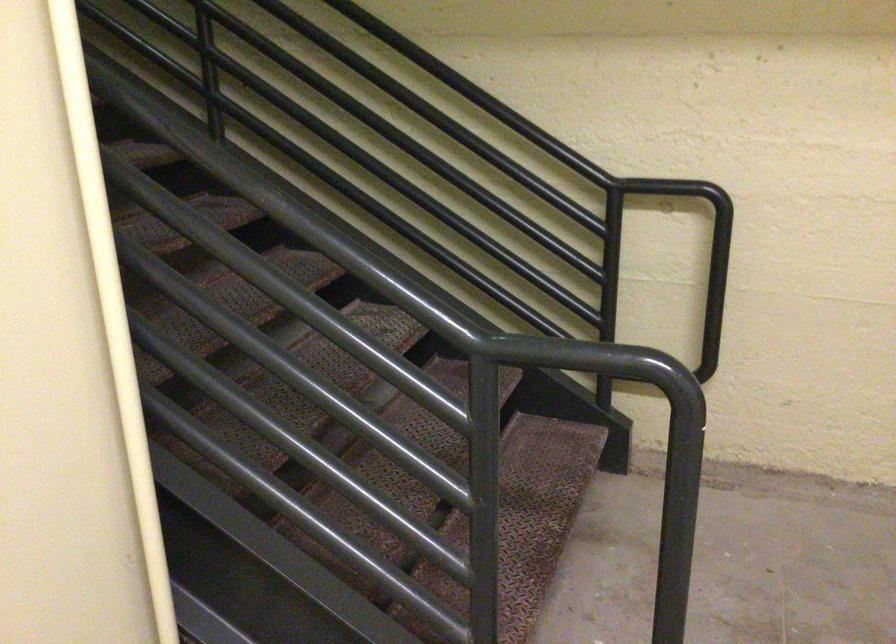
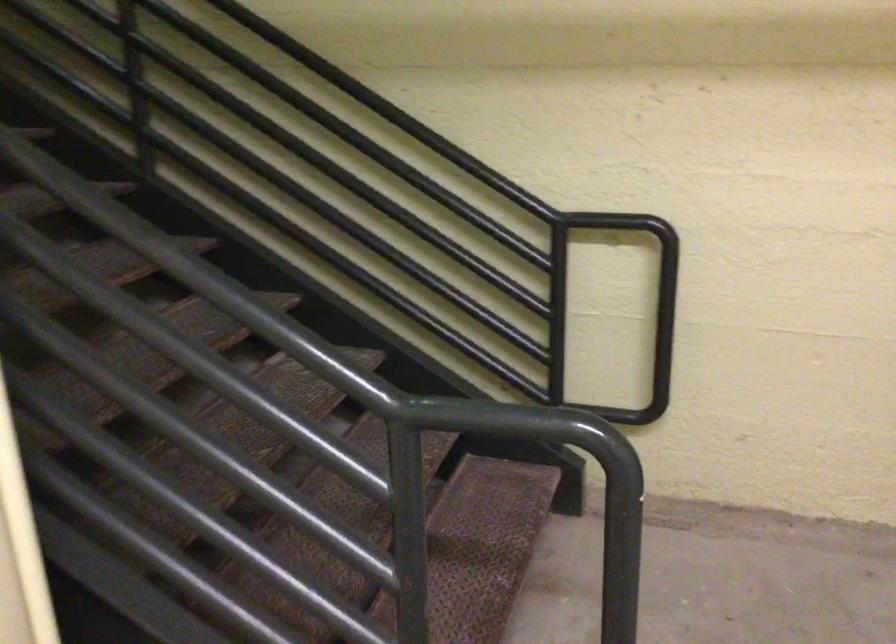
Question: The images are taken continuously from a first-person perspective. In which direction is your viewpoint rotating?

Choices:
 (A) Left
 (B) Right
 (C) Up
 (D) Down

Answer: (C)